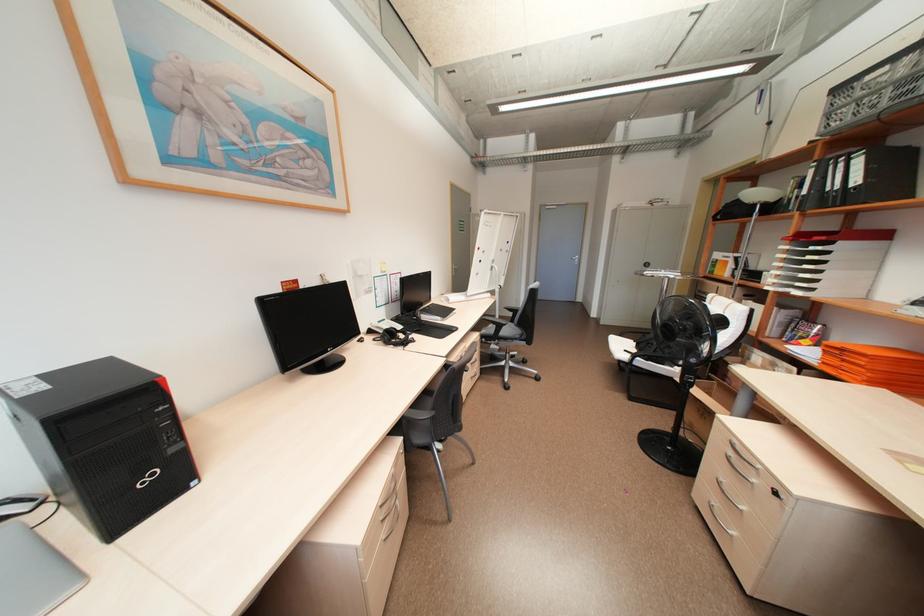
I want to click on grey cabinet handle, so click(x=739, y=455).